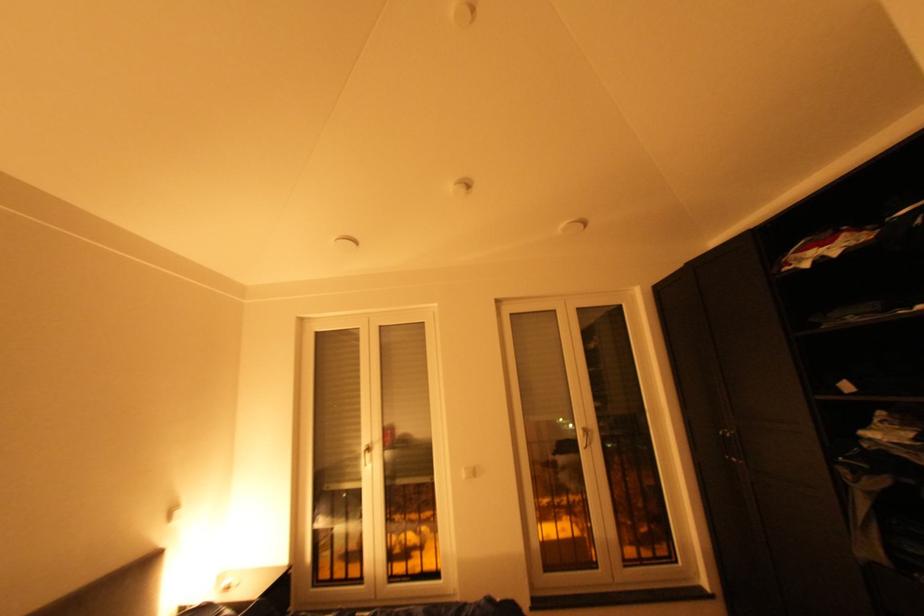
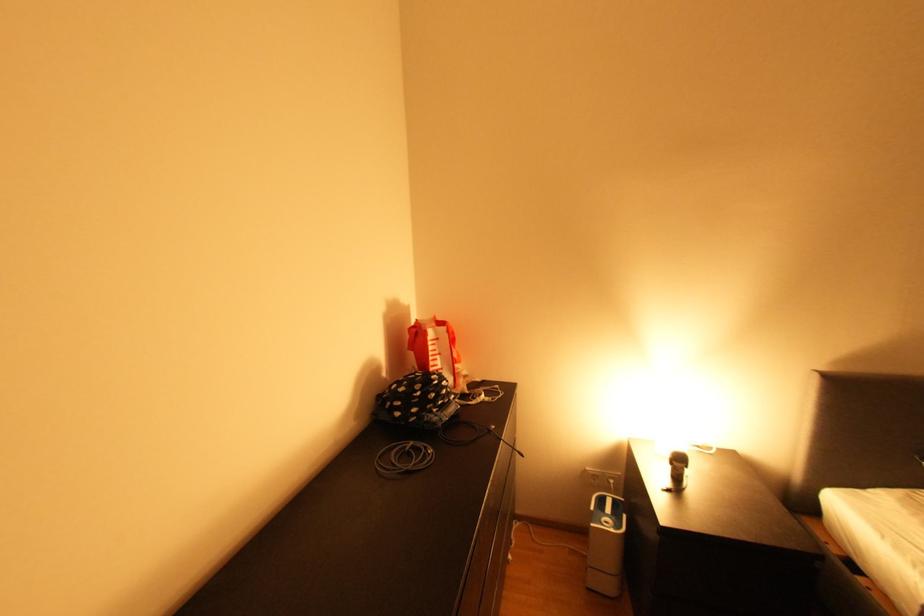
Question: The images are taken continuously from a first-person perspective. In which direction is your viewpoint rotating?

Choices:
 (A) Left
 (B) Right
 (C) Up
 (D) Down

Answer: (A)